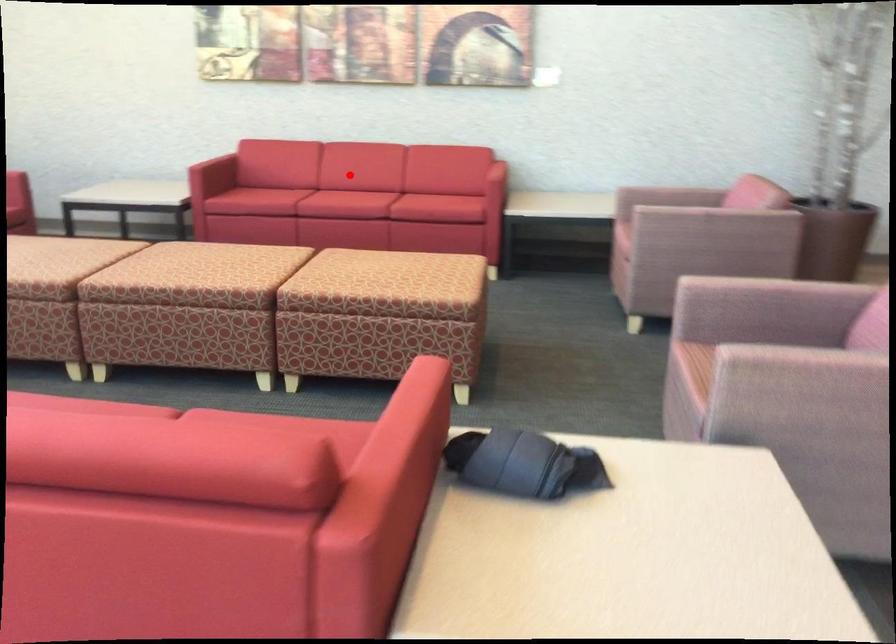
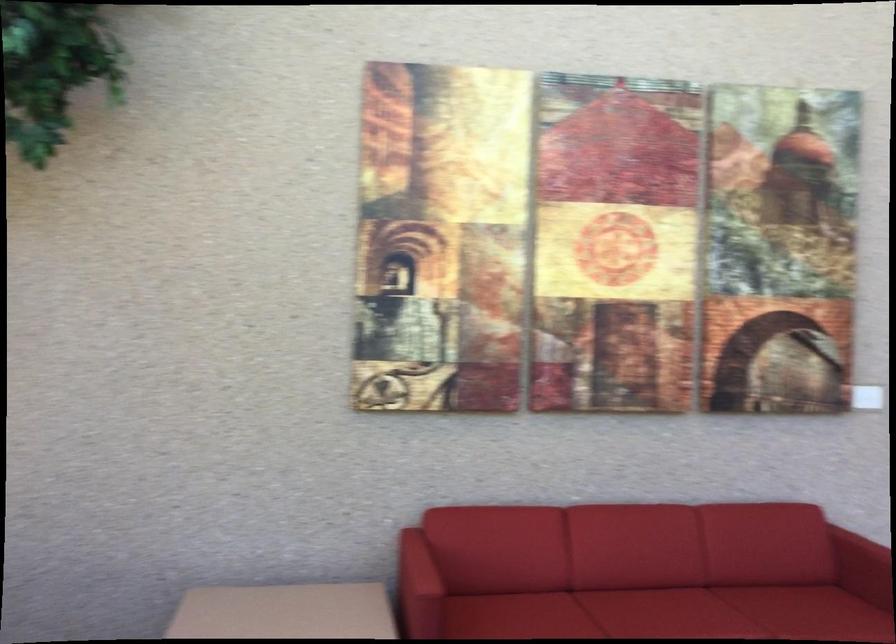
Question: A red point is marked in image1. In image2, is the corresponding 3D point closer to the camera or farther? Reply with the corresponding letter.

Choices:
 (A) The corresponding 3D point is closer.
 (B) The corresponding 3D point is farther.

Answer: (A)